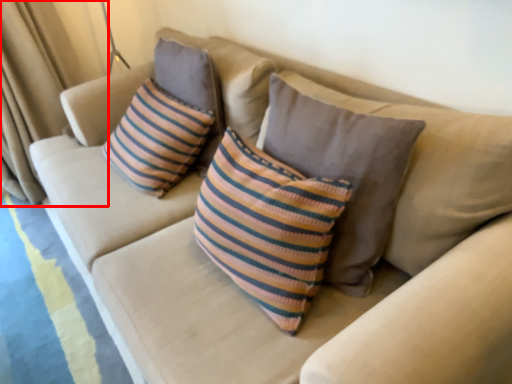
Question: Considering the relative positions of curtain (annotated by the red box) and pillow in the image provided, where is curtain (annotated by the red box) located with respect to the staircase?

Choices:
 (A) left
 (B) right

Answer: (A)